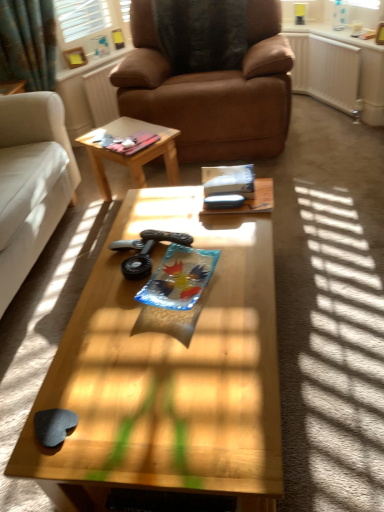
I want to click on vacant area that lies to the right of wooden coffee table at center, acting as the second coffee table starting from the back, so click(332, 323).